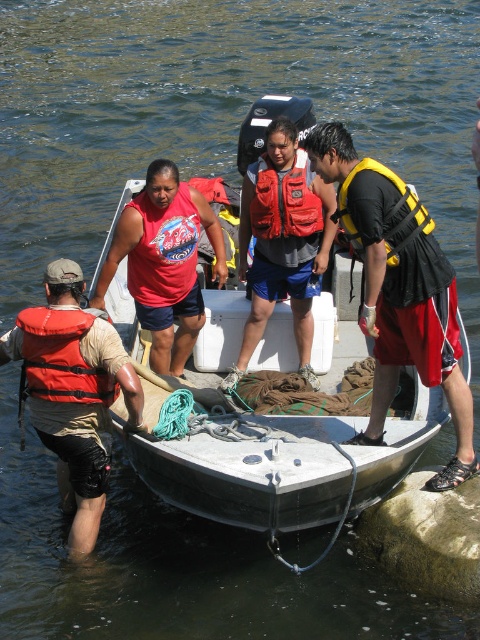
Question: Can you confirm if matte red tank top at center is wider than yellow fabric life jacket at right?

Choices:
 (A) yes
 (B) no

Answer: (A)

Question: Which point is closer to the camera taking this photo?

Choices:
 (A) (69, 374)
 (B) (380, 163)
 (C) (342, 131)

Answer: (C)

Question: Does matte red tank top at center have a larger size compared to yellow fabric life jacket at right?

Choices:
 (A) no
 (B) yes

Answer: (B)

Question: Which point is closer to the camera?

Choices:
 (A) yellow fabric life jacket at right
 (B) red life vest at center

Answer: (A)

Question: Which object is farther from the camera taking this photo?

Choices:
 (A) matte orange life jacket at left
 (B) metallic gray boat at center
 (C) matte orange life vest at left
 (D) matte red tank top at center

Answer: (D)

Question: Is red life vest at center to the right of yellow fabric life jacket at right from the viewer's perspective?

Choices:
 (A) yes
 (B) no

Answer: (B)